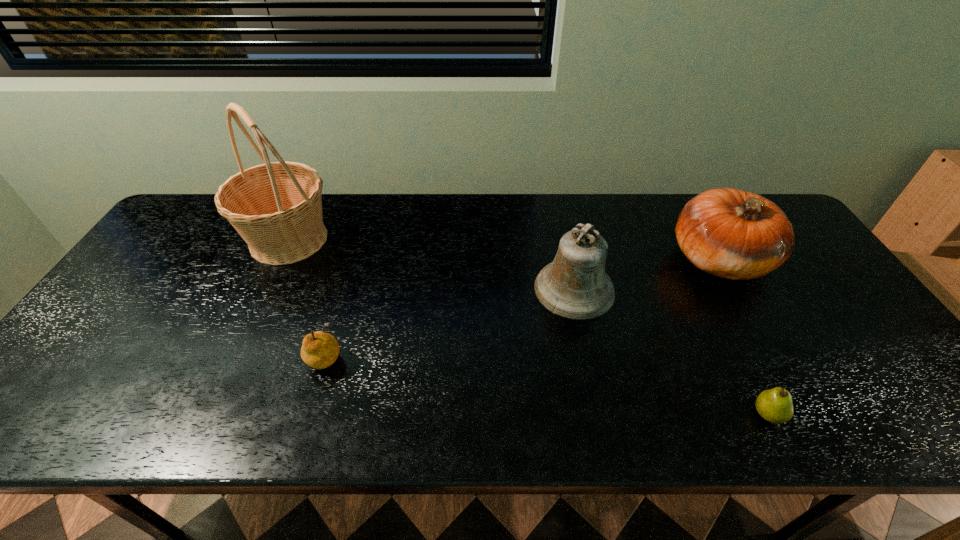
Image resolution: width=960 pixels, height=540 pixels. What are the coordinates of `the tallest object` in the screenshot? It's located at (276, 207).

At what (x,y) coordinates should I click in order to perform the action: click on the leftmost object. Please return your answer as a coordinate pair (x, y). The image size is (960, 540). Looking at the image, I should click on (276, 207).

Identify the location of bell. (575, 286).

Locate an element on the screen. pumpkin is located at coordinates (729, 233).

Find the location of a particular element. the farther pear is located at coordinates (319, 350).

Where is `the fourth object from right to left`? Image resolution: width=960 pixels, height=540 pixels. the fourth object from right to left is located at coordinates (319, 350).

The height and width of the screenshot is (540, 960). In order to click on the right pear in this screenshot , I will do `click(775, 405)`.

Where is `the nearer pear`? the nearer pear is located at coordinates click(x=775, y=405).

At what (x,y) coordinates should I click in order to perform the action: click on vacant area located on the front of the tallest object. Please return your answer as a coordinate pair (x, y). Looking at the image, I should click on (265, 290).

You are a GUI agent. You are given a task and a screenshot of the screen. Output one action in this format:
    pyautogui.click(x=<x>, y=<y>)
    Task: Click on the free space located 0.230m on the left of the bell
    
    Given the screenshot: What is the action you would take?
    pyautogui.click(x=449, y=289)